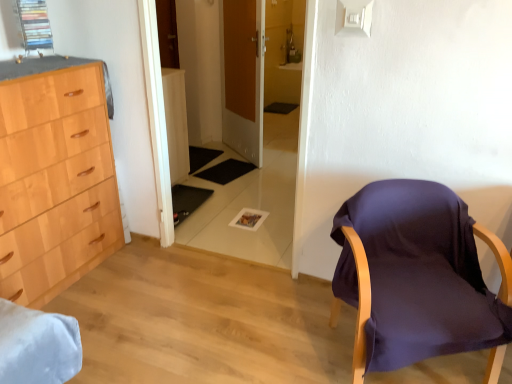
Question: From the image's perspective, is transparent glass door at center located above or below purple fabric chair at right?

Choices:
 (A) below
 (B) above

Answer: (B)

Question: Is point (223, 92) closer or farther from the camera than point (462, 339)?

Choices:
 (A) farther
 (B) closer

Answer: (A)

Question: Estimate the real-world distances between objects in this image. Which object is farther from the transparent glass door at center?

Choices:
 (A) wooden door at center
 (B) purple fabric chair at right

Answer: (B)

Question: Which object is positioned closest to the transparent glass door at center?

Choices:
 (A) purple fabric chair at right
 (B) wooden door at center

Answer: (B)